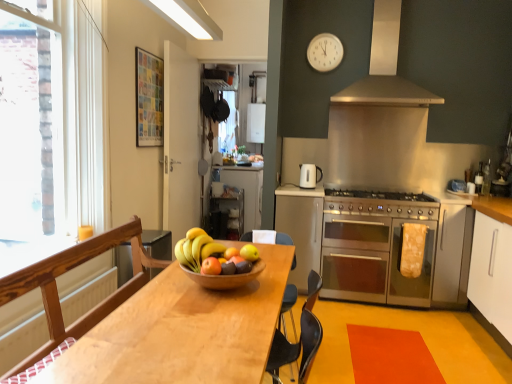
Question: Can you confirm if metallic silver oven at center-right, which appears as the first appliance when viewed from the right, is wider than white glossy cabinet at center, arranged as the second cabinetry when viewed from the front?

Choices:
 (A) no
 (B) yes

Answer: (A)

Question: From the image's perspective, is metallic silver oven at center-right, marked as the 2th appliance in a bottom-to-top arrangement, beneath white glossy cabinet at center, the second cabinetry viewed from the right?

Choices:
 (A) yes
 (B) no

Answer: (B)

Question: Does metallic silver oven at center-right, which appears as the first appliance when viewed from the right, lie in front of white glossy cabinet at center, arranged as the second cabinetry when viewed from the front?

Choices:
 (A) yes
 (B) no

Answer: (B)

Question: From a real-world perspective, is metallic silver oven at center-right, which appears as the first appliance when viewed from the right, beneath white glossy cabinet at center, arranged as the second cabinetry when viewed from the front?

Choices:
 (A) yes
 (B) no

Answer: (B)

Question: Is white glossy cabinet at center, the second cabinetry viewed from the right, a part of metallic silver oven at center-right, which is counted as the 1th appliance, starting from the top?

Choices:
 (A) no
 (B) yes

Answer: (A)

Question: Is white glossy cabinet at center, positioned as the 2th cabinetry in left-to-right order, at the back of metallic silver oven at center-right, which appears as the first appliance when viewed from the right?

Choices:
 (A) yes
 (B) no

Answer: (B)

Question: Is orange matte at center at the left side of light brown wooden table at center?

Choices:
 (A) no
 (B) yes

Answer: (A)

Question: Is orange matte at center looking in the opposite direction of light brown wooden table at center?

Choices:
 (A) no
 (B) yes

Answer: (A)

Question: Can you confirm if orange matte at center is shorter than light brown wooden table at center?

Choices:
 (A) yes
 (B) no

Answer: (A)

Question: Is orange matte at center placed right next to light brown wooden table at center?

Choices:
 (A) no
 (B) yes

Answer: (A)

Question: Can you confirm if orange matte at center is bigger than light brown wooden table at center?

Choices:
 (A) yes
 (B) no

Answer: (B)

Question: Does orange matte at center turn towards light brown wooden table at center?

Choices:
 (A) yes
 (B) no

Answer: (B)

Question: From a real-world perspective, is stainless steel oven at center right on top of metallic silver microwave at center, positioned as the second appliance in right-to-left order?

Choices:
 (A) yes
 (B) no

Answer: (B)